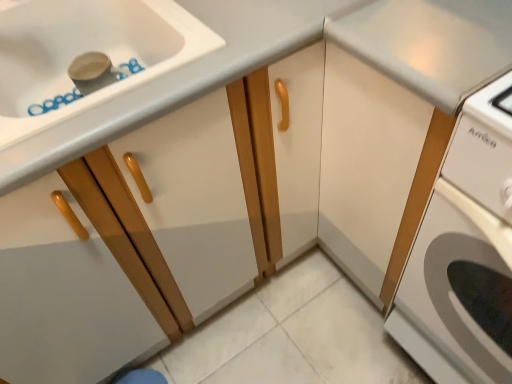
Question: From a real-world perspective, relative to white glossy washing machine at right, is matte wood cabinet at left, which is the 2th cabinetry from right to left, vertically above or below?

Choices:
 (A) below
 (B) above

Answer: (B)

Question: Is matte wood cabinet at left, the 1th cabinetry from the left, situated inside white glossy washing machine at right or outside?

Choices:
 (A) outside
 (B) inside

Answer: (A)

Question: Based on their relative distances, which object is nearer to the white matte cabinet at center, placed as the 1th cabinetry when sorted from right to left?

Choices:
 (A) matte wood cabinet at left, the 1th cabinetry from the left
 (B) white glossy washing machine at right

Answer: (B)

Question: Which is nearer to the matte wood cabinet at left, which is the 2th cabinetry from right to left?

Choices:
 (A) white matte cabinet at center, placed as the 1th cabinetry when sorted from right to left
 (B) white glossy washing machine at right

Answer: (A)